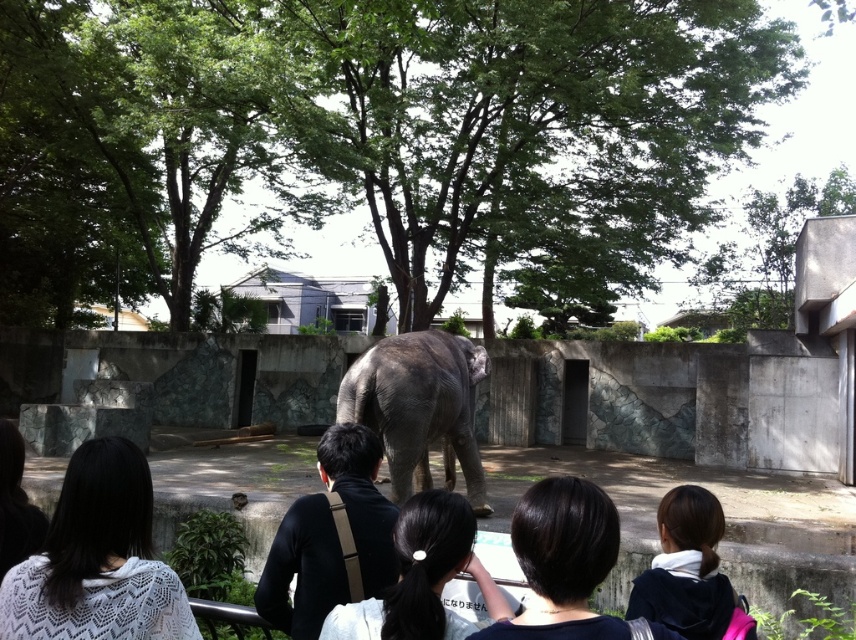
You are a zookeeper trying to locate two dark brown hairs left by an elephant. You see dark brown hair at lower right and dark brown hair at lower left. Which hair is closer to the ground?

The dark brown hair at lower right is below dark brown hair at lower left, so it is closer to the ground.

You are a zookeeper observing the elephant enclosure. You notice two hairs on the ground near the barrier. One is black hair at center and the other is dark brown hair at lower left. Which hair is closer to the visitors standing behind the barrier?

The black hair at center is closer to the visitors standing behind the barrier because it is in front of the dark brown hair at lower left.